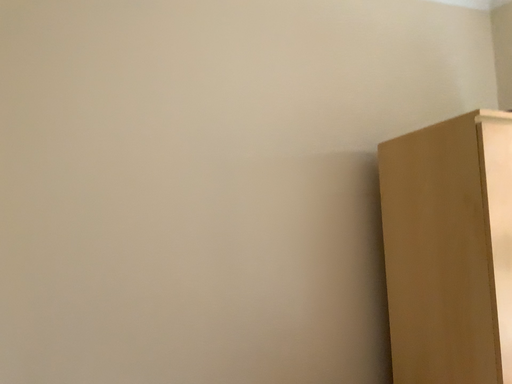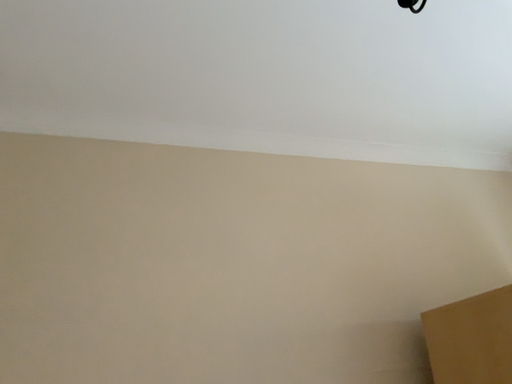
Question: How did the camera likely rotate when shooting the video?

Choices:
 (A) rotated downward
 (B) rotated upward

Answer: (B)